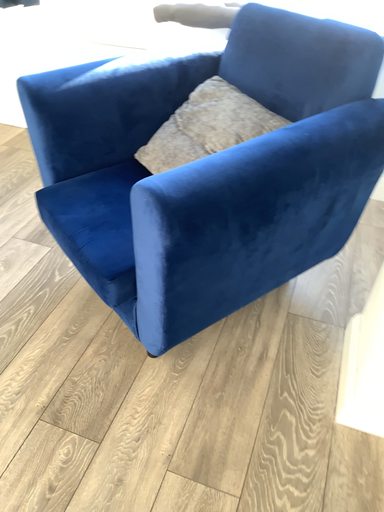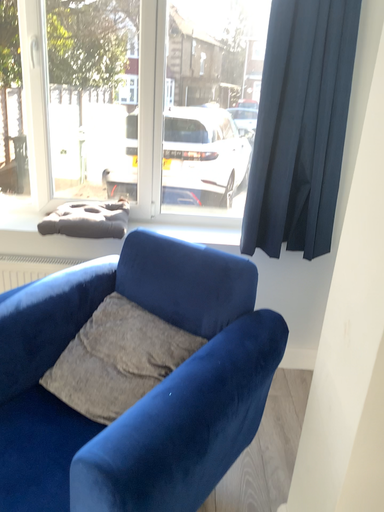
Question: Which way did the camera rotate in the video?

Choices:
 (A) rotated left
 (B) rotated right

Answer: (B)